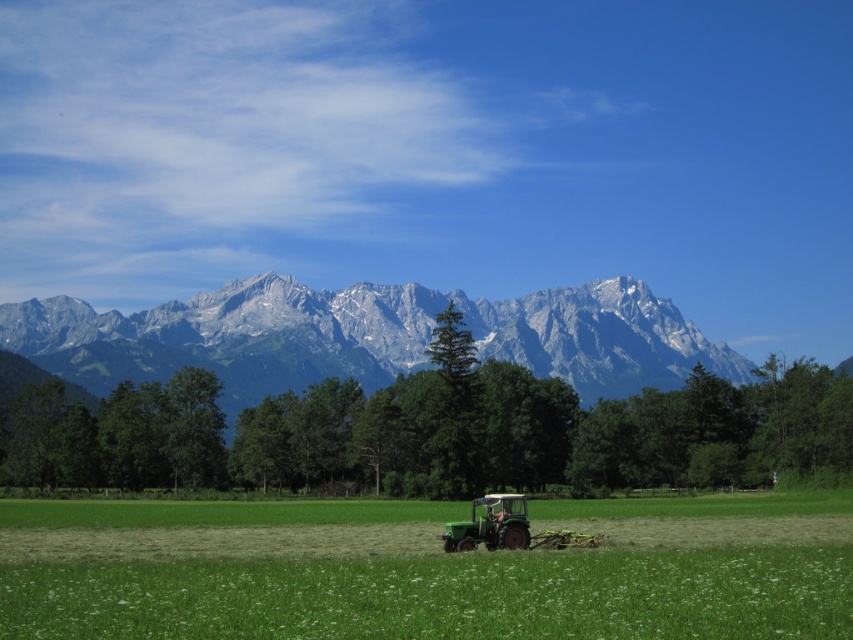
You are standing in the middle of the green grass at center and want to walk towards the green matte tractor at lower center. Which direction should you walk to get closer to the tractor?

Since the green grass at center is closer to the viewer than the green matte tractor at lower center, you should walk forward towards the tractor to get closer to it.

You are standing at the point marked as point (425,570) in the image. What do you see directly below you?

At point (425,570) lies green grass at center.